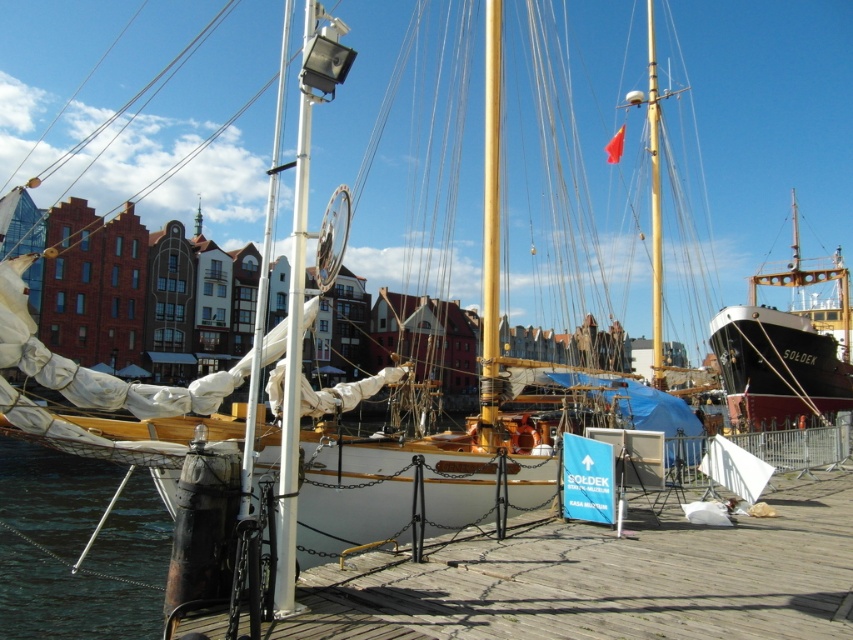
Which of these two, clear water at lower left or gold polished mast at center, stands shorter?

clear water at lower left

Based on the photo, can you confirm if clear water at lower left is positioned below gold polished mast at center?

Indeed, clear water at lower left is positioned under gold polished mast at center.

Describe the element at coordinates (68, 600) in the screenshot. I see `clear water at lower left` at that location.

Locate an element on the screen. This screenshot has height=640, width=853. clear water at lower left is located at coordinates (68, 600).

Between point (788, 406) and point (495, 385), which one is positioned behind?

The point (788, 406) is more distant.

Consider the image. Can you confirm if black polished wood ship at right is positioned below gold polished mast at center?

Yes.

Identify the location of black polished wood ship at right. This screenshot has width=853, height=640. (782, 349).

Can you confirm if wooden at center is shorter than clear water at lower left?

No.

What do you see at coordinates (604, 579) in the screenshot? This screenshot has width=853, height=640. I see `wooden at center` at bounding box center [604, 579].

What do you see at coordinates (604, 579) in the screenshot?
I see `wooden at center` at bounding box center [604, 579].

Locate an element on the screen. The height and width of the screenshot is (640, 853). wooden at center is located at coordinates (604, 579).